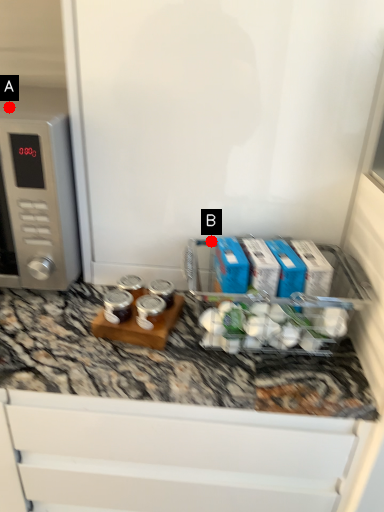
Question: Two points are circled on the image, labeled by A and B beside each circle. Which point is closer to the camera?

Choices:
 (A) A is closer
 (B) B is closer

Answer: (A)